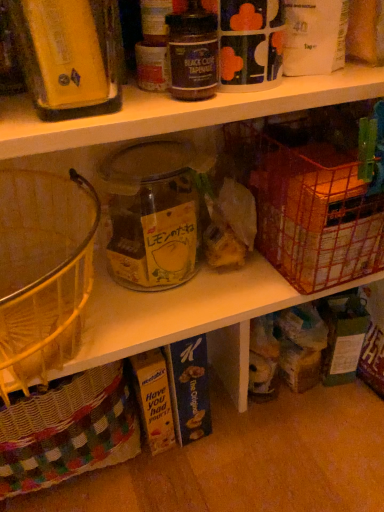
This screenshot has width=384, height=512. Identify the location of vacant space that is to the left of black glass jar at upper center, which ranks as the 2th bottle in left-to-right order. (94, 104).